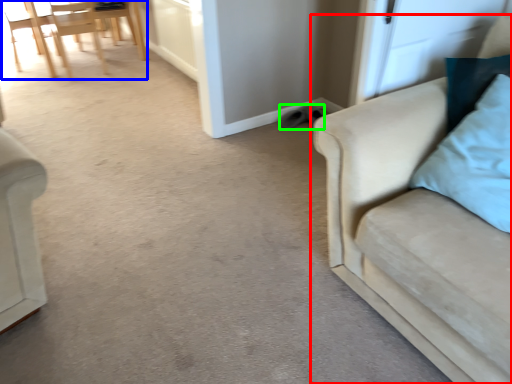
Question: Estimate the real-world distances between objects in this image. Which object is closer to studio couch (highlighted by a red box), chair (highlighted by a blue box) or footwear (highlighted by a green box)?

Choices:
 (A) chair
 (B) footwear

Answer: (B)